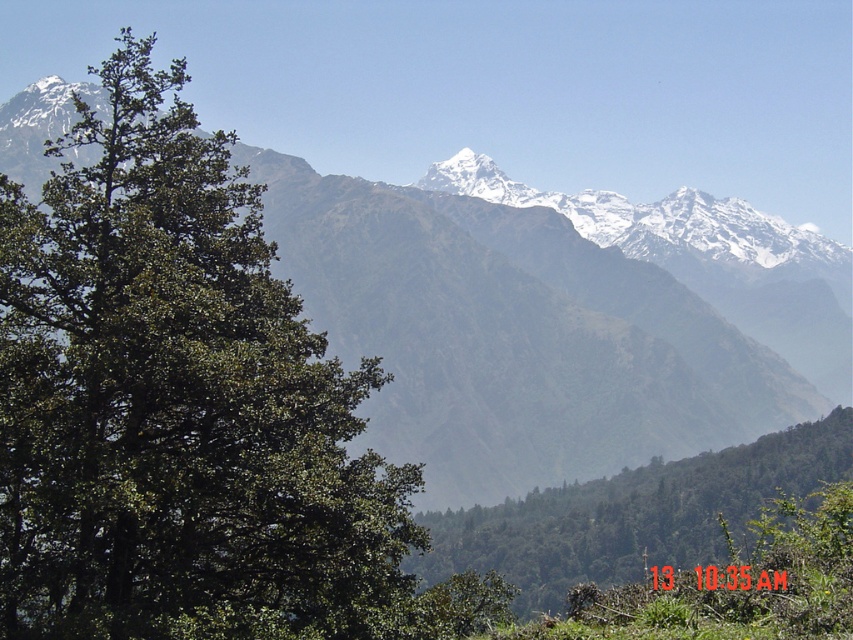
Question: Based on their relative distances, which object is farther from the green textured mountain range at center?

Choices:
 (A) green leafy tree at left
 (B) green leafy tree at center

Answer: (A)

Question: Which point is farther from the camera taking this photo?

Choices:
 (A) (56, 280)
 (B) (506, 554)

Answer: (B)

Question: Is green textured mountain range at center bigger than green leafy tree at center?

Choices:
 (A) no
 (B) yes

Answer: (B)

Question: Is green leafy tree at left wider than green textured mountain range at center?

Choices:
 (A) yes
 (B) no

Answer: (B)

Question: Which point is farther from the camera taking this photo?

Choices:
 (A) (202, 275)
 (B) (532, 477)
 (C) (698, 552)

Answer: (B)

Question: Considering the relative positions of green textured mountain range at center and green leafy tree at center in the image provided, where is green textured mountain range at center located with respect to green leafy tree at center?

Choices:
 (A) right
 (B) left

Answer: (B)